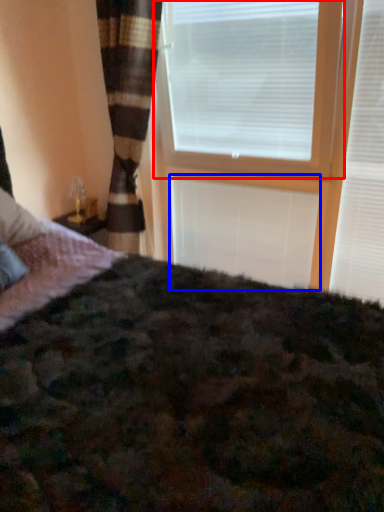
Question: Which of the following is the farthest to the observer, window blind (highlighted by a red box) or blind (highlighted by a blue box)?

Choices:
 (A) window blind
 (B) blind

Answer: (B)